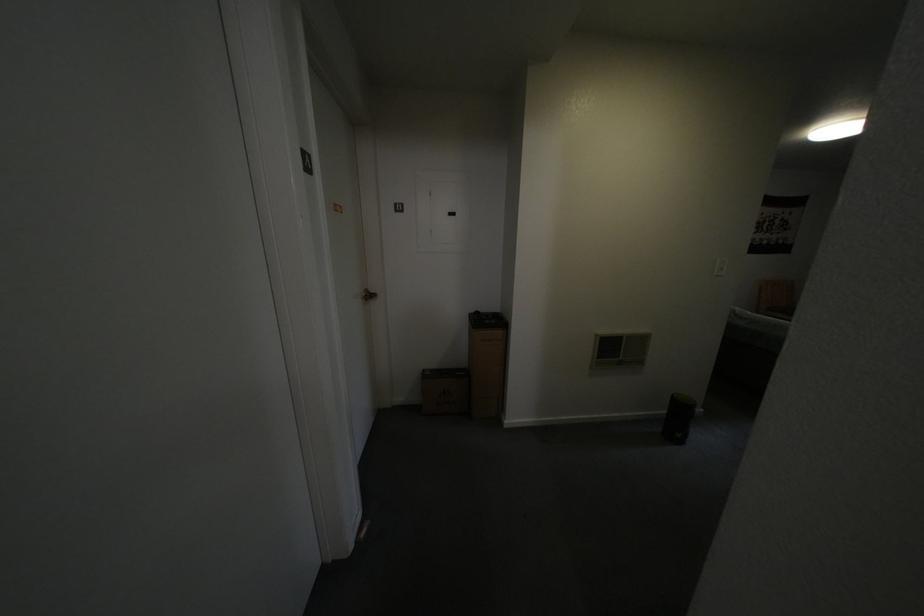
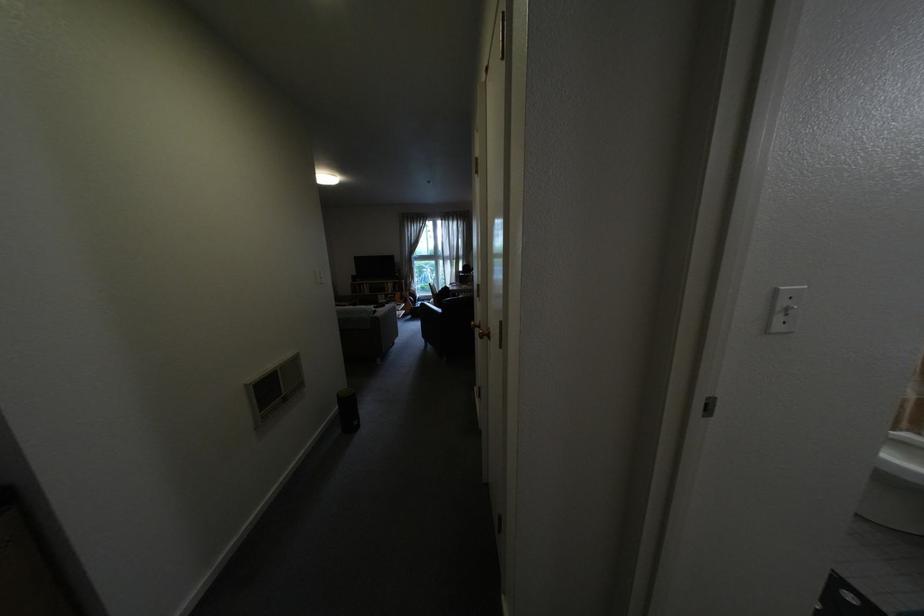
Question: The first image is from the beginning of the video and the second image is from the end. How did the camera likely rotate when shooting the video?

Choices:
 (A) Left
 (B) Right
 (C) Up
 (D) Down

Answer: (B)